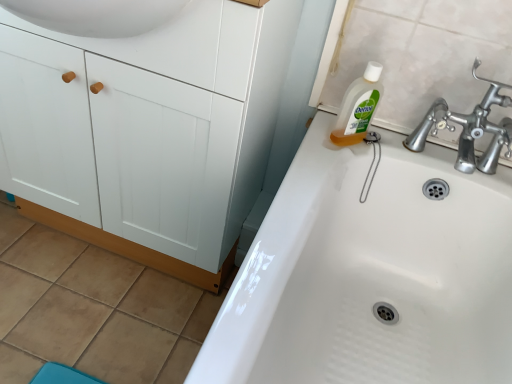
Question: Is the surface of white glossy sink at upper right in direct contact with white matte cabinet at left?

Choices:
 (A) no
 (B) yes

Answer: (A)

Question: Is white glossy sink at upper right to the right of white matte cabinet at left from the viewer's perspective?

Choices:
 (A) no
 (B) yes

Answer: (B)

Question: Does white glossy sink at upper right have a greater width compared to white matte cabinet at left?

Choices:
 (A) no
 (B) yes

Answer: (B)

Question: Considering the relative sizes of white glossy sink at upper right and white matte cabinet at left in the image provided, is white glossy sink at upper right thinner than white matte cabinet at left?

Choices:
 (A) no
 (B) yes

Answer: (A)

Question: Is white glossy sink at upper right far from white matte cabinet at left?

Choices:
 (A) no
 (B) yes

Answer: (A)

Question: Considering the positions of point (36, 56) and point (193, 380), is point (36, 56) closer or farther from the camera than point (193, 380)?

Choices:
 (A) farther
 (B) closer

Answer: (A)

Question: Is white matte cabinet at left in front of or behind white glossy sink at upper right in the image?

Choices:
 (A) behind
 (B) front

Answer: (A)

Question: Is white matte cabinet at left taller or shorter than white glossy sink at upper right?

Choices:
 (A) short
 (B) tall

Answer: (B)

Question: From a real-world perspective, relative to white glossy sink at upper right, is white matte cabinet at left vertically above or below?

Choices:
 (A) below
 (B) above

Answer: (B)

Question: Is white matte cabinet at left taller or shorter than clear liquid soap at upper right?

Choices:
 (A) short
 (B) tall

Answer: (B)

Question: Is white matte cabinet at left situated inside clear liquid soap at upper right or outside?

Choices:
 (A) outside
 (B) inside

Answer: (A)

Question: Looking at the image, does white matte cabinet at left seem bigger or smaller compared to clear liquid soap at upper right?

Choices:
 (A) big
 (B) small

Answer: (A)

Question: Considering their positions, is white matte cabinet at left located in front of or behind clear liquid soap at upper right?

Choices:
 (A) front
 (B) behind

Answer: (A)

Question: Based on their positions, is clear liquid soap at upper right located to the left or right of white matte cabinet at left?

Choices:
 (A) left
 (B) right

Answer: (B)

Question: Is point (342, 114) positioned closer to the camera than point (10, 165)?

Choices:
 (A) closer
 (B) farther

Answer: (A)